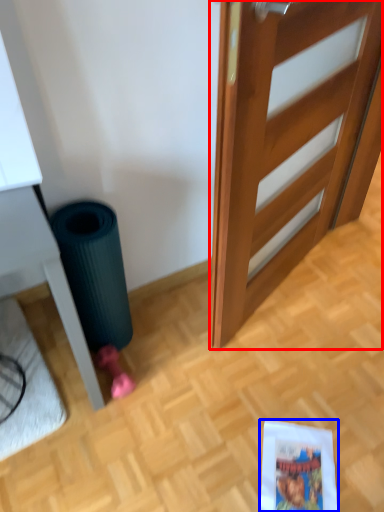
Question: Which object appears farthest to the camera in this image, door (highlighted by a red box) or comic book (highlighted by a blue box)?

Choices:
 (A) door
 (B) comic book

Answer: (B)